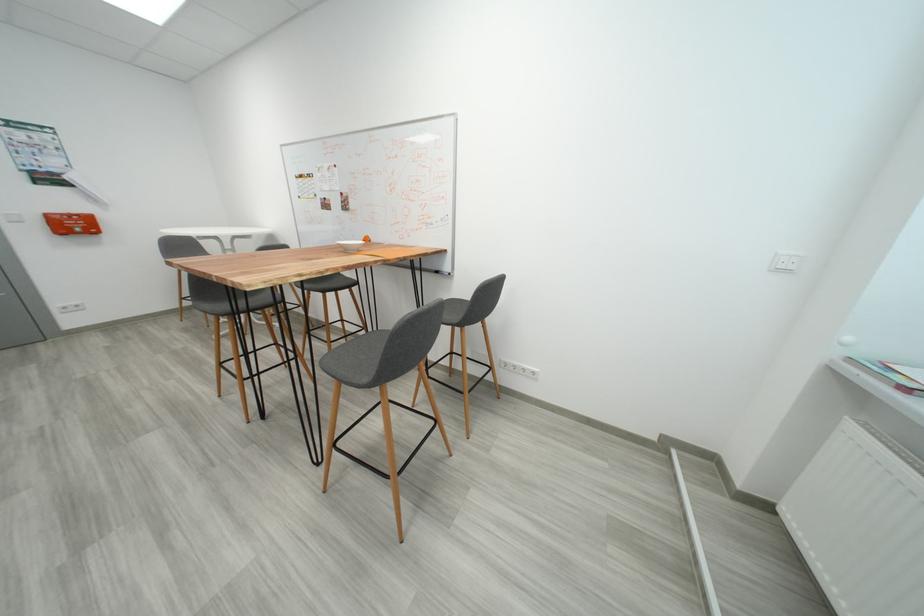
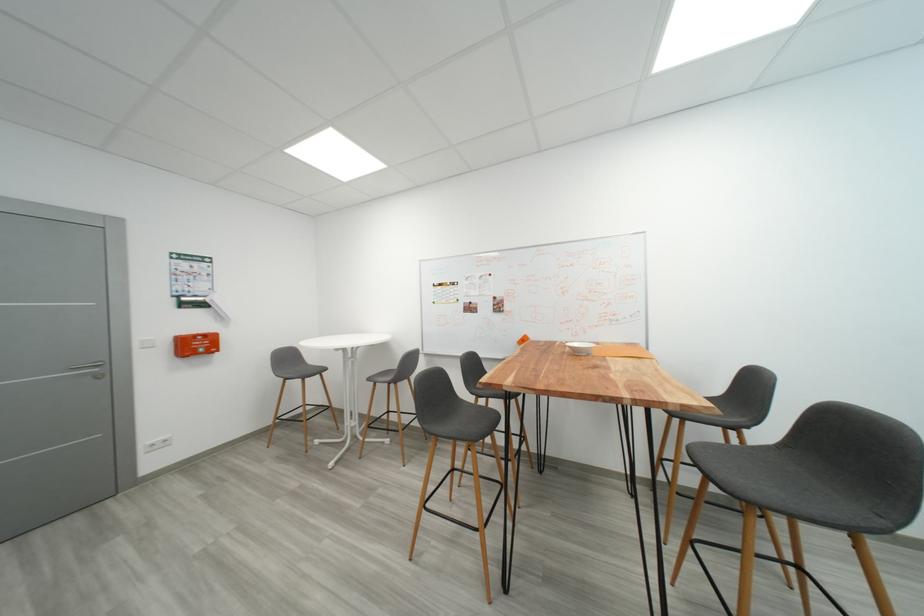
The point at (82, 228) is marked in the first image. Where is the corresponding point in the second image?

(203, 347)